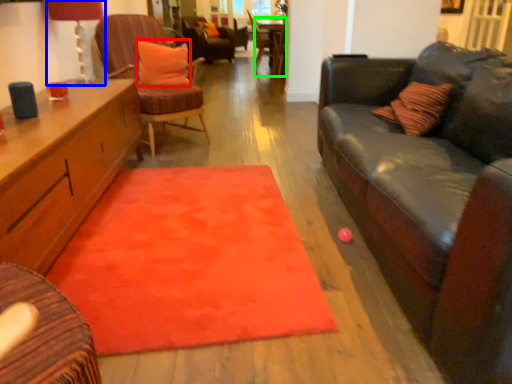
Question: Estimate the real-world distances between objects in this image. Which object is closer to pillow (highlighted by a red box), lamp (highlighted by a blue box) or table (highlighted by a green box)?

Choices:
 (A) lamp
 (B) table

Answer: (A)